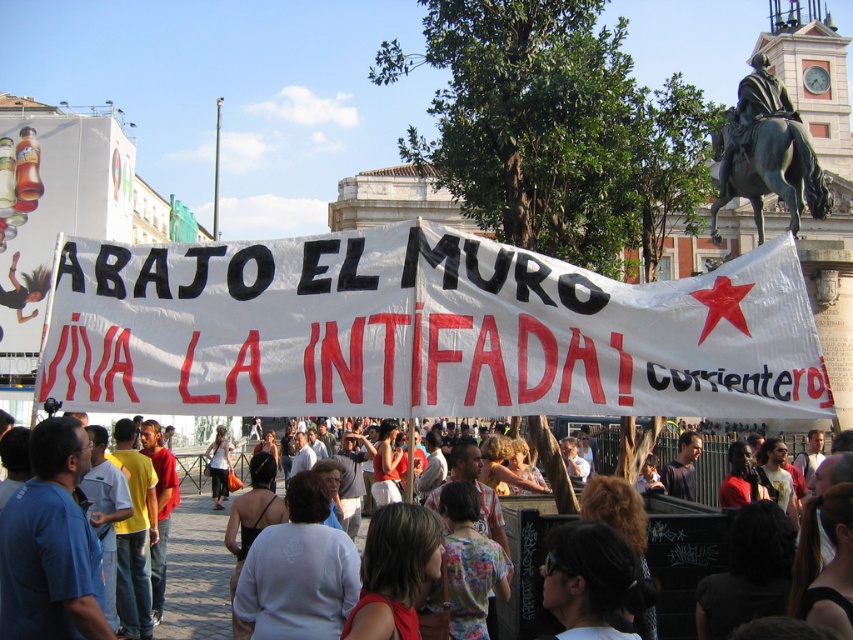
You are a photographer standing at the edge of the crowd in the city square. You want to take a photo of the statue of a horse and rider in the background, but there is a person wearing a white cotton shirt at center blocking your view. Where should you move to avoid the obstruction?

To avoid the obstruction caused by the white cotton shirt at center, you should move to the left or right of the white cotton shirt at center since the statue is in the background and the person is blocking the center view.

You are a photographer standing at the edge of the crowd. You want to take a photo of the bronze statue of man on horse at upper right without including the white cotton shirt at center in the frame. Is this possible based on their positions?

The white cotton shirt at center is below the bronze statue of man on horse at upper right, so if you position yourself to frame the statue higher in the viewfinder, you can exclude the white cotton shirt at center by adjusting your angle or zoom.